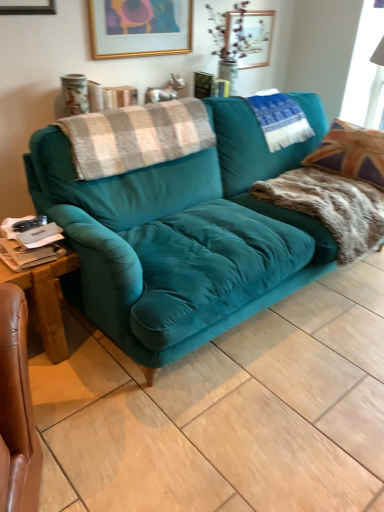
What do you see at coordinates (365, 72) in the screenshot? I see `white fabric at upper right` at bounding box center [365, 72].

Identify the location of white fabric at upper right. This screenshot has width=384, height=512. (365, 72).

Identify the location of teal velvet couch at center. The height and width of the screenshot is (512, 384). (184, 234).

Describe the element at coordinates (280, 120) in the screenshot. I see `teal velvet pillow at upper right` at that location.

Where is `fuzzy brown blanket at right, the 1th blanket in the right-to-left sequence`? fuzzy brown blanket at right, the 1th blanket in the right-to-left sequence is located at coordinates (331, 206).

What is the approximate width of gold-framed picture at upper center, the first picture frame viewed from the left?

gold-framed picture at upper center, the first picture frame viewed from the left, is 5.25 centimeters wide.

Based on the photo, measure the distance between gold-framed picture at upper center, the second picture frame when ordered from back to front, and camera.

The distance of gold-framed picture at upper center, the second picture frame when ordered from back to front, from camera is 2.13 meters.

What do you see at coordinates (351, 153) in the screenshot?
I see `fur-like fabric pillow at right` at bounding box center [351, 153].

Locate an element on the screen. The image size is (384, 512). white fabric at upper right is located at coordinates (365, 72).

This screenshot has height=512, width=384. In order to click on pillow located underneath the plaid woolen blanket at upper left, the first blanket from the left (from a real-world perspective) in this screenshot , I will do `click(280, 120)`.

Is plaid woolen blanket at upper left, which appears as the 2th blanket when viewed from the right, to the left of teal velvet pillow at upper right from the viewer's perspective?

Yes.

Does point (101, 167) come behind point (253, 102)?

No, it is not.

Is plaid woolen blanket at upper left, which appears as the 2th blanket when viewed from the right, in front of teal velvet pillow at upper right?

Yes, plaid woolen blanket at upper left, which appears as the 2th blanket when viewed from the right, is closer to the viewer.

Considering their positions, is white fabric at upper right located in front of or behind fur-like fabric pillow at right?

Visually, white fabric at upper right is located behind fur-like fabric pillow at right.

Can you tell me how much white fabric at upper right and fur-like fabric pillow at right differ in facing direction?

91.8 degrees.

From the image's perspective, relative to fur-like fabric pillow at right, is white fabric at upper right above or below?

white fabric at upper right is situated higher than fur-like fabric pillow at right in the image.

From a real-world perspective, who is located lower, white fabric at upper right or fur-like fabric pillow at right?

fur-like fabric pillow at right.

Between gold-framed picture at upper center, arranged as the 2th picture frame when viewed from the right, and fuzzy brown blanket at right, the 1th blanket in the right-to-left sequence, which one is positioned behind?

Positioned behind is gold-framed picture at upper center, arranged as the 2th picture frame when viewed from the right.

Could fuzzy brown blanket at right, acting as the second blanket starting from the left, be considered to be inside gold-framed picture at upper center, the first picture frame viewed from the left?

No, fuzzy brown blanket at right, acting as the second blanket starting from the left, is not inside gold-framed picture at upper center, the first picture frame viewed from the left.

Is gold-framed picture at upper center, the first picture frame viewed from the left, smaller than fuzzy brown blanket at right, the 1th blanket in the right-to-left sequence?

Indeed, gold-framed picture at upper center, the first picture frame viewed from the left, has a smaller size compared to fuzzy brown blanket at right, the 1th blanket in the right-to-left sequence.

Could teal velvet pillow at upper right be considered to be inside white fabric at upper right?

No.

Looking at their sizes, would you say white fabric at upper right is wider or thinner than teal velvet pillow at upper right?

Considering their sizes, white fabric at upper right looks broader than teal velvet pillow at upper right.

Are white fabric at upper right and teal velvet pillow at upper right beside each other?

white fabric at upper right is not next to teal velvet pillow at upper right, and they're not touching.

Based on the photo, can you tell me how much white fabric at upper right and teal velvet pillow at upper right differ in facing direction?

There is a 90.2-degree angle between the facing directions of white fabric at upper right and teal velvet pillow at upper right.

Considering the positions of objects white fabric at upper right and wooden picture frame at upper center, which is counted as the second picture frame, starting from the front, in the image provided, who is more to the left, white fabric at upper right or wooden picture frame at upper center, which is counted as the second picture frame, starting from the front,?

Positioned to the left is wooden picture frame at upper center, which is counted as the second picture frame, starting from the front.

How different are the orientations of white fabric at upper right and wooden picture frame at upper center, which appears as the second picture frame when viewed from the left, in degrees?

The angle between the facing direction of white fabric at upper right and the facing direction of wooden picture frame at upper center, which appears as the second picture frame when viewed from the left, is 90.8 degrees.

Does white fabric at upper right have a lesser height compared to wooden picture frame at upper center, which is counted as the second picture frame, starting from the front?

No.

Is white fabric at upper right aimed at wooden picture frame at upper center, which is counted as the second picture frame, starting from the front?

No, white fabric at upper right is not oriented towards wooden picture frame at upper center, which is counted as the second picture frame, starting from the front.

Is teal velvet pillow at upper right not near gold-framed picture at upper center, the 1th picture frame viewed from the front?

teal velvet pillow at upper right is near gold-framed picture at upper center, the 1th picture frame viewed from the front, not far away.

Is gold-framed picture at upper center, arranged as the 2th picture frame when viewed from the right, surrounded by teal velvet pillow at upper right?

Definitely not — gold-framed picture at upper center, arranged as the 2th picture frame when viewed from the right, is not inside teal velvet pillow at upper right.

In the scene shown: From a real-world perspective, which object stands above the other?

gold-framed picture at upper center, the second picture frame when ordered from back to front.

Can you confirm if teal velvet pillow at upper right is positioned to the right of gold-framed picture at upper center, the 1th picture frame viewed from the front?

Yes, teal velvet pillow at upper right is to the right of gold-framed picture at upper center, the 1th picture frame viewed from the front.

Who is shorter, gold-framed picture at upper center, the 1th picture frame viewed from the front, or plaid woolen blanket at upper left, the first blanket from the left?

plaid woolen blanket at upper left, the first blanket from the left, is shorter.

Which of these two, gold-framed picture at upper center, the first picture frame viewed from the left, or plaid woolen blanket at upper left, which appears as the 2th blanket when viewed from the right, is bigger?

plaid woolen blanket at upper left, which appears as the 2th blanket when viewed from the right, is bigger.

Measure the distance from gold-framed picture at upper center, the second picture frame when ordered from back to front, to plaid woolen blanket at upper left, the first blanket from the left.

gold-framed picture at upper center, the second picture frame when ordered from back to front, is 24.51 inches from plaid woolen blanket at upper left, the first blanket from the left.

From the picture: From the image's perspective, which is above, gold-framed picture at upper center, the second picture frame when ordered from back to front, or plaid woolen blanket at upper left, which appears as the 2th blanket when viewed from the right?

From the image's view, gold-framed picture at upper center, the second picture frame when ordered from back to front, is above.

Locate an element on the screen. The height and width of the screenshot is (512, 384). pillow below the plaid woolen blanket at upper left, which appears as the 2th blanket when viewed from the right (from a real-world perspective) is located at coordinates (280, 120).

Where is `window screen above the fur-like fabric pillow at right (from a real-world perspective)`? This screenshot has width=384, height=512. window screen above the fur-like fabric pillow at right (from a real-world perspective) is located at coordinates (365, 72).

From the image, which object appears to be farther from teal velvet pillow at upper right, fuzzy brown blanket at right, acting as the second blanket starting from the left, or gold-framed picture at upper center, arranged as the 2th picture frame when viewed from the right?

The object further to teal velvet pillow at upper right is gold-framed picture at upper center, arranged as the 2th picture frame when viewed from the right.

From the picture: From the image, which object appears to be farther from fur-like fabric pillow at right, fuzzy brown blanket at right, acting as the second blanket starting from the left, or gold-framed picture at upper center, arranged as the 2th picture frame when viewed from the right?

gold-framed picture at upper center, arranged as the 2th picture frame when viewed from the right, lies further to fur-like fabric pillow at right than the other object.

Estimate the real-world distances between objects in this image. Which object is closer to fur-like fabric pillow at right, teal velvet couch at center or teal velvet pillow at upper right?

Based on the image, teal velvet pillow at upper right appears to be nearer to fur-like fabric pillow at right.

When comparing their distances from gold-framed picture at upper center, the 1th picture frame viewed from the front, does teal velvet pillow at upper right or wooden picture frame at upper center, marked as the 1th picture frame in a right-to-left arrangement, seem closer?

Based on the image, wooden picture frame at upper center, marked as the 1th picture frame in a right-to-left arrangement, appears to be nearer to gold-framed picture at upper center, the 1th picture frame viewed from the front.

Based on the photo, from the image, which object appears to be farther from fuzzy brown blanket at right, acting as the second blanket starting from the left, white fabric at upper right or plaid woolen blanket at upper left, which appears as the 2th blanket when viewed from the right?

white fabric at upper right.

When comparing their distances from white fabric at upper right, does teal velvet couch at center or fuzzy brown blanket at right, acting as the second blanket starting from the left, seem closer?

The object closer to white fabric at upper right is fuzzy brown blanket at right, acting as the second blanket starting from the left.

Based on their spatial positions, is fur-like fabric pillow at right or wooden picture frame at upper center, which is counted as the second picture frame, starting from the front, further from white fabric at upper right?

The object further to white fabric at upper right is wooden picture frame at upper center, which is counted as the second picture frame, starting from the front.

From the image, which object appears to be farther from fur-like fabric pillow at right, gold-framed picture at upper center, arranged as the 2th picture frame when viewed from the right, or plaid woolen blanket at upper left, which appears as the 2th blanket when viewed from the right?

Among the two, gold-framed picture at upper center, arranged as the 2th picture frame when viewed from the right, is located further to fur-like fabric pillow at right.

Where is `blanket situated between plaid woolen blanket at upper left, which appears as the 2th blanket when viewed from the right, and fur-like fabric pillow at right from left to right`? This screenshot has height=512, width=384. blanket situated between plaid woolen blanket at upper left, which appears as the 2th blanket when viewed from the right, and fur-like fabric pillow at right from left to right is located at coordinates (331, 206).

Find the location of a particular element. pillow between gold-framed picture at upper center, the first picture frame viewed from the left, and fuzzy brown blanket at right, acting as the second blanket starting from the left is located at coordinates (280, 120).

Locate an element on the screen. throw pillow between teal velvet pillow at upper right and white fabric at upper right is located at coordinates (351, 153).

At what (x,y) coordinates should I click in order to perform the action: click on picture frame positioned between teal velvet couch at center and teal velvet pillow at upper right from near to far. Please return your answer as a coordinate pair (x, y). The height and width of the screenshot is (512, 384). Looking at the image, I should click on (140, 28).